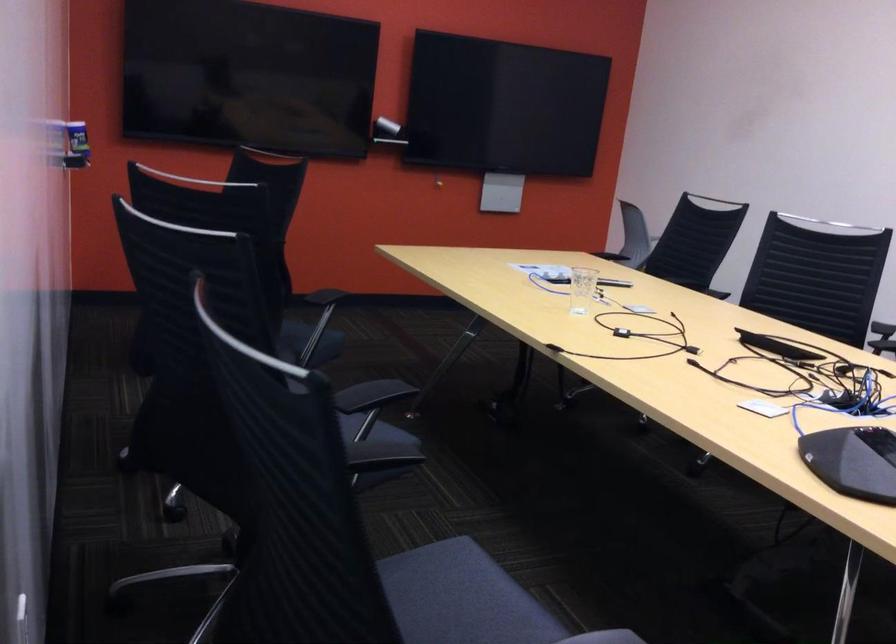
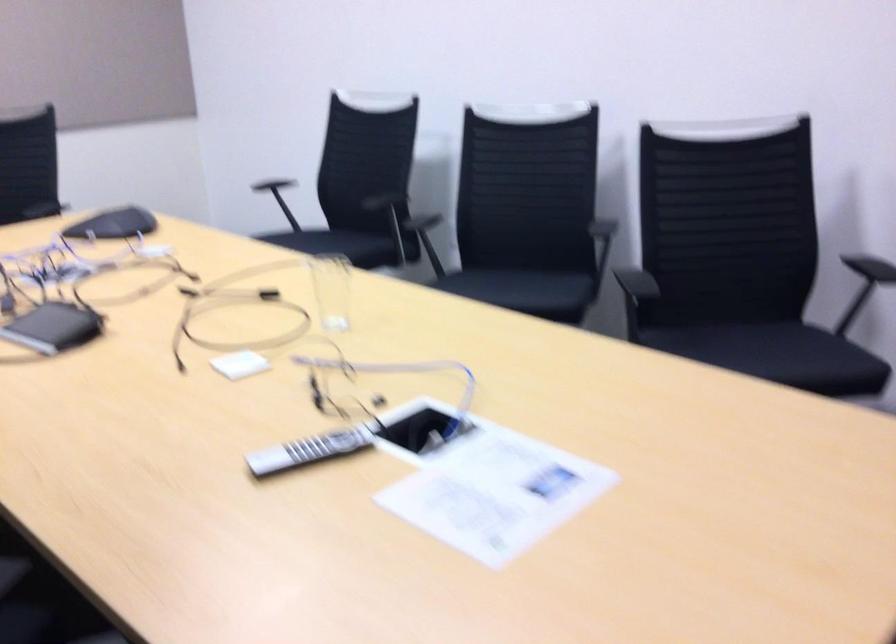
In the second image, find the point that corresponds to point 554,283 in the first image.

(419, 430)